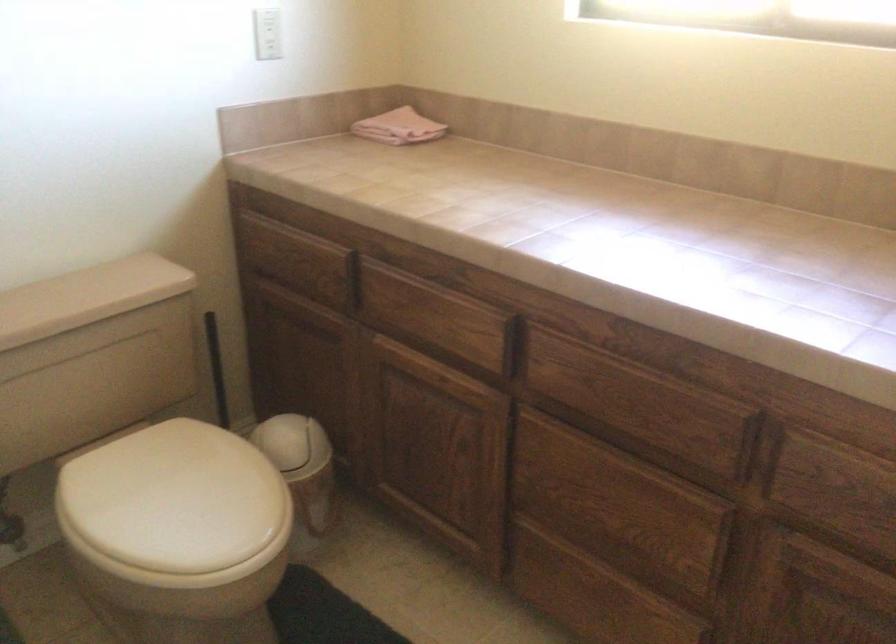
Locate an element on the screen. beige toilet lid is located at coordinates (176, 500).